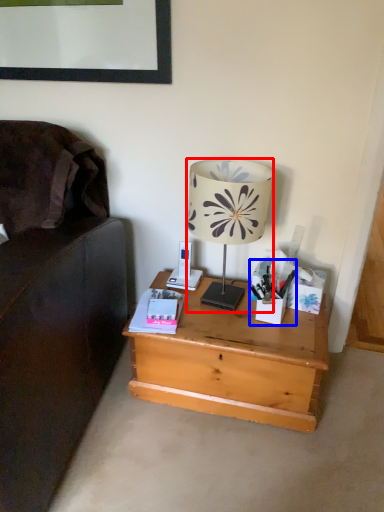
Question: Among these objects, which one is nearest to the camera, lamp (highlighted by a red box) or stationery (highlighted by a blue box)?

Choices:
 (A) lamp
 (B) stationery

Answer: (A)